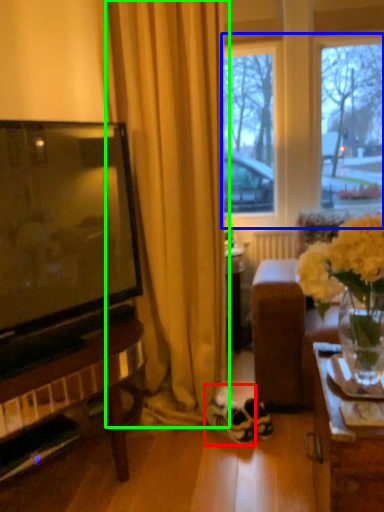
Question: Which object is the farthest from sneakers (highlighted by a red box)? Choose among these: window frame (highlighted by a blue box) or curtain (highlighted by a green box).

Choices:
 (A) window frame
 (B) curtain

Answer: (A)